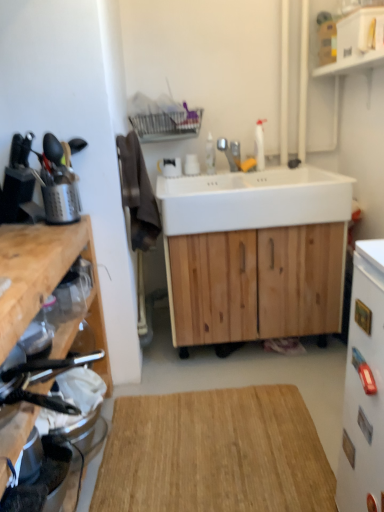
Identify the location of silver metallic faucet at center. (227, 154).

Measure the distance between silver metallic faucet at center and camera.

The distance of silver metallic faucet at center from camera is 7.53 feet.

The height and width of the screenshot is (512, 384). What do you see at coordinates (46, 278) in the screenshot?
I see `wooden cutting board at left, arranged as the 1th cabinetry when viewed from the front` at bounding box center [46, 278].

At what (x,y) coordinates should I click in order to perform the action: click on wooden cutting board at left, placed as the first cabinetry when sorted from left to right. Please return your answer as a coordinate pair (x, y). Looking at the image, I should click on (46, 278).

Describe the element at coordinates (253, 200) in the screenshot. This screenshot has width=384, height=512. I see `white ceramic sink at center` at that location.

The height and width of the screenshot is (512, 384). I want to click on brushed metal utensil holder at left, marked as the fifth appliance in a right-to-left arrangement, so click(61, 200).

Which is closer to the camera, (360,388) or (74,183)?

Positioned in front is point (360,388).

In the scene shown: Based on their sizes in the image, would you say white glossy refrigerator at right, which is the 5th appliance from left to right, is bigger or smaller than brushed metal utensil holder at left, the 1th appliance viewed from the left?

Considering their sizes, white glossy refrigerator at right, which is the 5th appliance from left to right, takes up more space than brushed metal utensil holder at left, the 1th appliance viewed from the left.

Considering the sizes of white glossy refrigerator at right, the first appliance positioned from the right, and brushed metal utensil holder at left, the 1th appliance viewed from the left, in the image, is white glossy refrigerator at right, the first appliance positioned from the right, wider or thinner than brushed metal utensil holder at left, the 1th appliance viewed from the left,?

In the image, white glossy refrigerator at right, the first appliance positioned from the right, appears to be more narrow than brushed metal utensil holder at left, the 1th appliance viewed from the left.

From the picture: From a real-world perspective, is white glossy refrigerator at right, which is the 5th appliance from left to right, physically above brushed metal utensil holder at left, the 1th appliance viewed from the left?

No, from a real-world perspective, white glossy refrigerator at right, which is the 5th appliance from left to right, is not above brushed metal utensil holder at left, the 1th appliance viewed from the left.

Which is in front, clear plastic jar at left, the third appliance in the left-to-right sequence, or natural wood cutting board at center?

Positioned in front is natural wood cutting board at center.

Does clear plastic jar at left, which is the third appliance in right-to-left order, have a greater width compared to natural wood cutting board at center?

No, clear plastic jar at left, which is the third appliance in right-to-left order, is not wider than natural wood cutting board at center.

Looking at this image, is clear plastic jar at left, which is the third appliance in right-to-left order, shorter than natural wood cutting board at center?

No, clear plastic jar at left, which is the third appliance in right-to-left order, is not shorter than natural wood cutting board at center.

Would you say clear plastic jar at left, which is the third appliance in right-to-left order, is to the left or to the right of natural wood cutting board at center in the picture?

In the image, clear plastic jar at left, which is the third appliance in right-to-left order, appears on the left side of natural wood cutting board at center.

Is white glossy refrigerator at right, which is the 5th appliance from left to right, oriented towards natural wood cabinet at center, which is the 2th cabinetry from front to back?

No, white glossy refrigerator at right, which is the 5th appliance from left to right, does not turn towards natural wood cabinet at center, which is the 2th cabinetry from front to back.

Between point (358, 386) and point (322, 250), which one is positioned behind?

The point (322, 250) is farther from the camera.

Is white glossy refrigerator at right, the first appliance positioned from the right, not near natural wood cabinet at center, the 1th cabinetry from the back?

No, white glossy refrigerator at right, the first appliance positioned from the right, is not far from natural wood cabinet at center, the 1th cabinetry from the back.

Identify the location of the 2nd cabinetry positioned below the white glossy refrigerator at right, which is the 5th appliance from left to right (from a real-world perspective). (257, 283).

Is silver metallic faucet at center at the left side of metallic silver toaster at left, which ranks as the fourth appliance in left-to-right order?

No, silver metallic faucet at center is not to the left of metallic silver toaster at left, which ranks as the fourth appliance in left-to-right order.

Could you tell me if silver metallic faucet at center is facing metallic silver toaster at left, the second appliance viewed from the right?

Yes, silver metallic faucet at center is oriented towards metallic silver toaster at left, the second appliance viewed from the right.

Looking at this image, how many degrees apart are the facing directions of silver metallic faucet at center and metallic silver toaster at left, which ranks as the fourth appliance in left-to-right order?

There is a 112-degree angle between the facing directions of silver metallic faucet at center and metallic silver toaster at left, which ranks as the fourth appliance in left-to-right order.

Based on the photo, between silver metallic faucet at center and metallic silver toaster at left, the second appliance viewed from the right, which one has more height?

silver metallic faucet at center.

Between natural wood cabinet at center, the 1th cabinetry from the back, and metallic silver utensil holder at left, the second appliance positioned from the left, which one has smaller size?

With smaller size is metallic silver utensil holder at left, the second appliance positioned from the left.

Is natural wood cabinet at center, the 1th cabinetry viewed from the right, wider or thinner than metallic silver utensil holder at left, the second appliance positioned from the left?

Clearly, natural wood cabinet at center, the 1th cabinetry viewed from the right, has more width compared to metallic silver utensil holder at left, the second appliance positioned from the left.

From the image's perspective, between natural wood cabinet at center, positioned as the 2th cabinetry in left-to-right order, and metallic silver utensil holder at left, the second appliance positioned from the left, who is located below?

From the image's view, natural wood cabinet at center, positioned as the 2th cabinetry in left-to-right order, is below.

From a real-world perspective, which appliance is the 4th one above the natural wood cabinet at center, the 1th cabinetry from the back? Please provide its 2D coordinates.

[(58, 182)]

Which of these two, brushed metal utensil holder at left, marked as the fifth appliance in a right-to-left arrangement, or silver metallic faucet at center, is smaller?

Smaller between the two is brushed metal utensil holder at left, marked as the fifth appliance in a right-to-left arrangement.

Starting from the silver metallic faucet at center, which appliance is the 1st one in front? Please provide its 2D coordinates.

[(61, 200)]

From the image's perspective, which one is positioned higher, metallic silver utensil holder at left, the second appliance positioned from the left, or wooden cutting board at left, the second cabinetry viewed from the back?

metallic silver utensil holder at left, the second appliance positioned from the left.

Which is in front, point (44, 142) or point (14, 300)?

Point (14, 300)

Does metallic silver utensil holder at left, the second appliance positioned from the left, have a greater width compared to wooden cutting board at left, arranged as the 1th cabinetry when viewed from the front?

Incorrect, the width of metallic silver utensil holder at left, the second appliance positioned from the left, does not surpass that of wooden cutting board at left, arranged as the 1th cabinetry when viewed from the front.

From a real-world perspective, between metallic silver utensil holder at left, the 4th appliance in the right-to-left sequence, and wooden cutting board at left, the second cabinetry viewed from the back, who is vertically higher?

metallic silver utensil holder at left, the 4th appliance in the right-to-left sequence, is physically above.

Where is `the 4th appliance behind the white glossy refrigerator at right, which is the 5th appliance from left to right, starting your count from the anchor`? The image size is (384, 512). the 4th appliance behind the white glossy refrigerator at right, which is the 5th appliance from left to right, starting your count from the anchor is located at coordinates (61, 200).

You are a GUI agent. You are given a task and a screenshot of the screen. Output one action in this format:
    pyautogui.click(x=<x>, y=<y>)
    Task: Click on the hardwood on the right of the clear plastic jar at left, the third appliance in the left-to-right sequence
    
    Given the screenshot: What is the action you would take?
    pyautogui.click(x=214, y=454)

Which object lies further to the anchor point silver metallic faucet at center, natural wood cutting board at center or metallic silver utensil holder at left, the second appliance positioned from the left?

Based on the image, natural wood cutting board at center appears to be further to silver metallic faucet at center.

In the scene shown: Which object lies nearer to the anchor point metallic silver utensil holder at left, the 4th appliance in the right-to-left sequence, metallic silver toaster at left, which ranks as the fourth appliance in left-to-right order, or clear plastic jar at left, which is the third appliance in right-to-left order?

Based on the image, clear plastic jar at left, which is the third appliance in right-to-left order, appears to be nearer to metallic silver utensil holder at left, the 4th appliance in the right-to-left sequence.

Which object lies nearer to the anchor point natural wood cutting board at center, clear plastic jar at left, the third appliance in the left-to-right sequence, or white glossy refrigerator at right, the first appliance positioned from the right?

white glossy refrigerator at right, the first appliance positioned from the right, lies closer to natural wood cutting board at center than the other object.

Consider the image. From the image, which object appears to be nearer to white ceramic sink at center, natural wood cabinet at center, the 1th cabinetry from the back, or brushed metal utensil holder at left, the 1th appliance viewed from the left?

Based on the image, natural wood cabinet at center, the 1th cabinetry from the back, appears to be nearer to white ceramic sink at center.

Looking at the image, which one is located further to natural wood cutting board at center, brushed metal utensil holder at left, marked as the fifth appliance in a right-to-left arrangement, or clear plastic jar at left, which is the third appliance in right-to-left order?

brushed metal utensil holder at left, marked as the fifth appliance in a right-to-left arrangement, lies further to natural wood cutting board at center than the other object.

Based on their spatial positions, is white ceramic sink at center or clear plastic jar at left, which is the third appliance in right-to-left order, further from metallic silver utensil holder at left, the 4th appliance in the right-to-left sequence?

white ceramic sink at center is further to metallic silver utensil holder at left, the 4th appliance in the right-to-left sequence.

Considering their positions, is natural wood cutting board at center positioned further to metallic silver toaster at left, the second appliance viewed from the right, than brushed metal utensil holder at left, marked as the fifth appliance in a right-to-left arrangement?

The object further to metallic silver toaster at left, the second appliance viewed from the right, is brushed metal utensil holder at left, marked as the fifth appliance in a right-to-left arrangement.

Based on their spatial positions, is white glossy refrigerator at right, the first appliance positioned from the right, or metallic silver utensil holder at left, the second appliance positioned from the left, closer to natural wood cutting board at center?

white glossy refrigerator at right, the first appliance positioned from the right.

You are a GUI agent. You are given a task and a screenshot of the screen. Output one action in this format:
    pyautogui.click(x=<x>, y=<y>)
    Task: Click on the sink between white glossy refrigerator at right, which is the 5th appliance from left to right, and silver metallic faucet at center, along the z-axis
    
    Given the screenshot: What is the action you would take?
    pyautogui.click(x=253, y=200)

Find the location of a particular element. This screenshot has height=512, width=384. sink between silver metallic faucet at center and metallic silver toaster at left, the second appliance viewed from the right, in the up-down direction is located at coordinates (253, 200).

Where is `hardwood situated between brushed metal utensil holder at left, marked as the fifth appliance in a right-to-left arrangement, and white glossy refrigerator at right, the first appliance positioned from the right, from left to right`? The height and width of the screenshot is (512, 384). hardwood situated between brushed metal utensil holder at left, marked as the fifth appliance in a right-to-left arrangement, and white glossy refrigerator at right, the first appliance positioned from the right, from left to right is located at coordinates (214, 454).

Find the location of a particular element. This screenshot has width=384, height=512. hardwood between wooden cutting board at left, placed as the first cabinetry when sorted from left to right, and silver metallic faucet at center in the front-back direction is located at coordinates (214, 454).